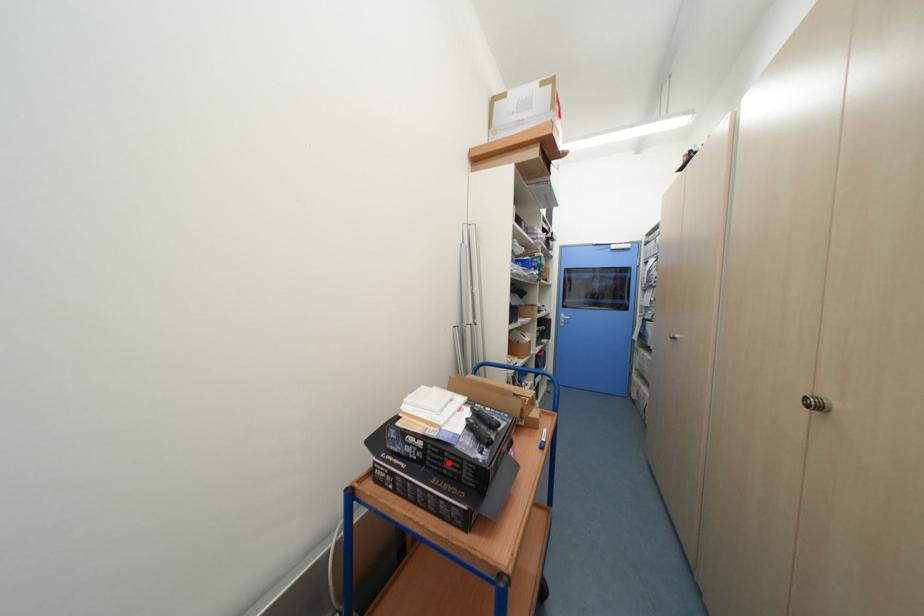
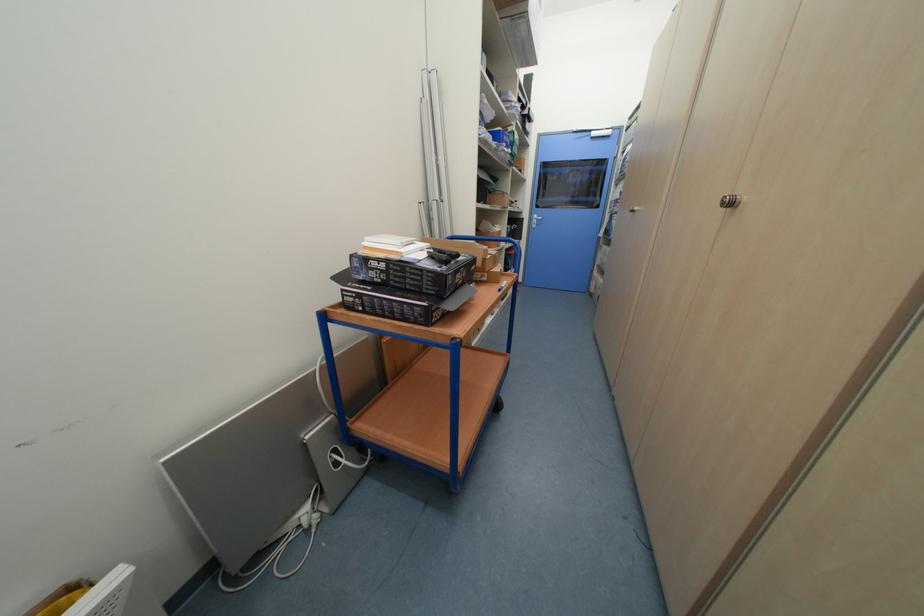
Where in the second image is the point corresponding to the highlighted location from the first image?

(410, 278)